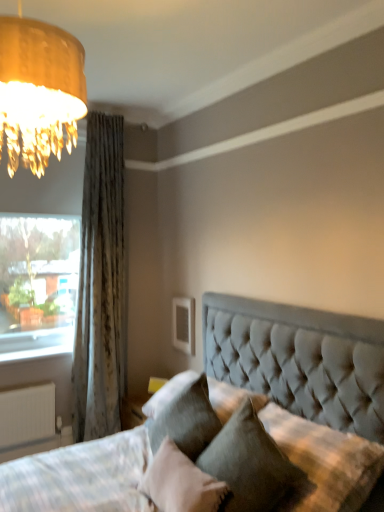
Question: From a real-world perspective, is white matte radiator at lower left above or below yellow fabric table lamp at lower center?

Choices:
 (A) above
 (B) below

Answer: (B)

Question: Considering the positions of point 21,439 and point 153,390, is point 21,439 closer or farther from the camera than point 153,390?

Choices:
 (A) closer
 (B) farther

Answer: (B)

Question: Which is farther from the clear glass window at left?

Choices:
 (A) white matte radiator at lower left
 (B) tufted fabric pillow at center, positioned as the 1th pillow in right-to-left order
 (C) yellow fabric table lamp at lower center
 (D) velvet gray pillow at lower center, which is the 2th pillow from right to left
 (E) textured gray curtain at left

Answer: (B)

Question: Considering the real-world distances, which object is closest to the velvet gray pillow at lower center, which ranks as the 1th pillow in left-to-right order?

Choices:
 (A) textured gray curtain at left
 (B) clear glass window at left
 (C) tufted fabric pillow at center, positioned as the 1th pillow in right-to-left order
 (D) yellow fabric table lamp at lower center
 (E) white matte radiator at lower left

Answer: (C)